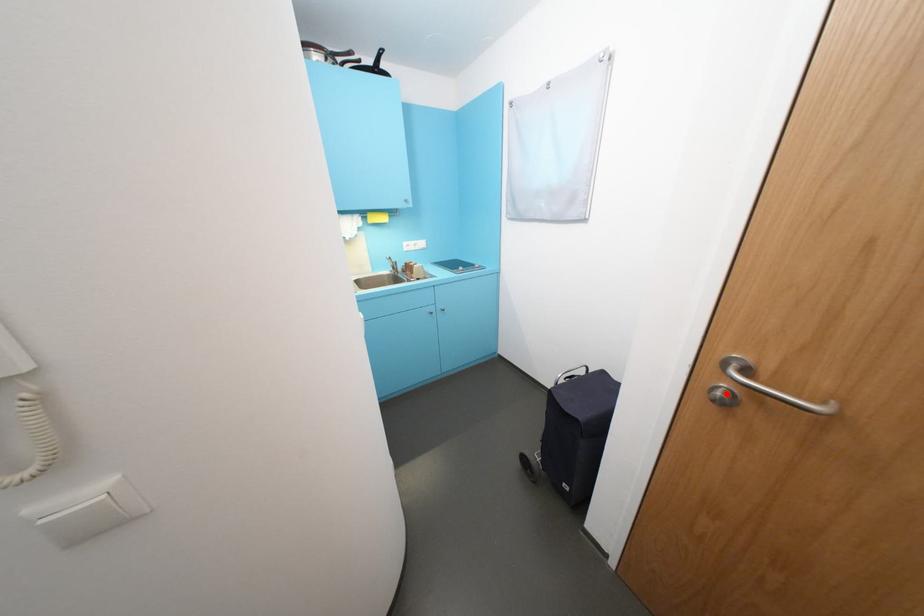
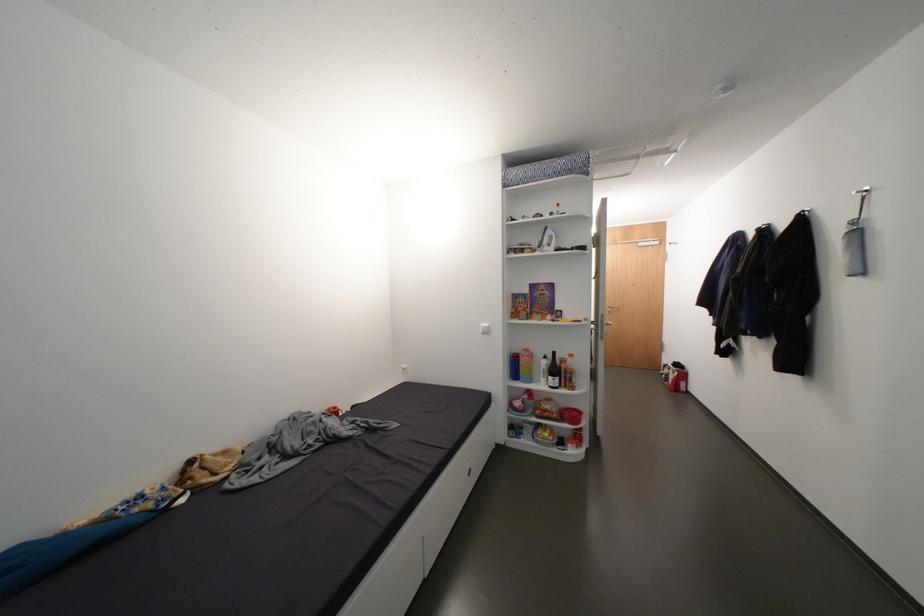
The point at the highlighted location is marked in the first image. Where is the corresponding point in the second image?

(616, 310)